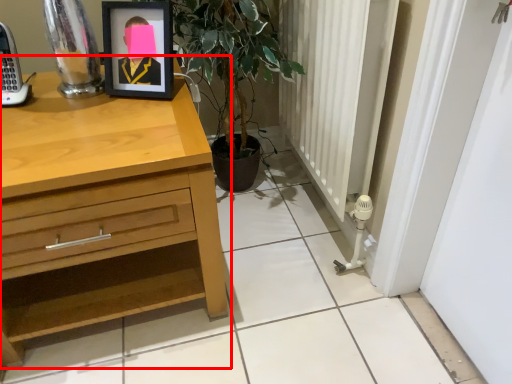
Question: From the image's perspective, what is the correct spatial relationship of chest of drawers (annotated by the red box) in relation to picture frame?

Choices:
 (A) above
 (B) below

Answer: (B)